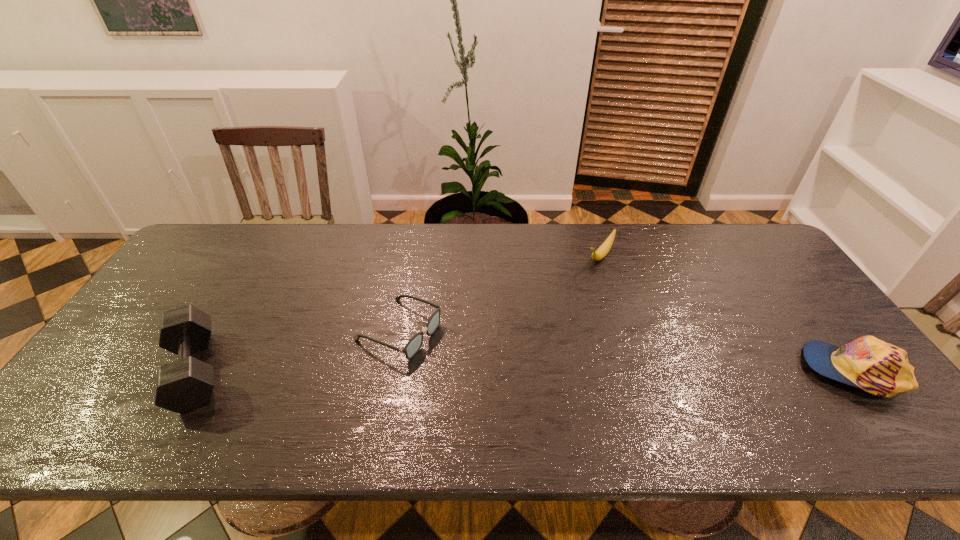
This screenshot has height=540, width=960. Find the location of `the leftmost object`. the leftmost object is located at coordinates (185, 384).

Find the location of a particular element. cap is located at coordinates (880, 368).

This screenshot has height=540, width=960. I want to click on the third object from right to left, so click(414, 344).

You are a GUI agent. You are given a task and a screenshot of the screen. Output one action in this format:
    pyautogui.click(x=<x>, y=<y>)
    Task: Click on the spectacles
    Image resolution: width=960 pixels, height=540 pixels.
    Given the screenshot: What is the action you would take?
    pyautogui.click(x=414, y=344)

Identify the location of the farthest object. The image size is (960, 540). (602, 251).

Where is `the second shortest object`? This screenshot has height=540, width=960. the second shortest object is located at coordinates (602, 251).

This screenshot has height=540, width=960. In order to click on free space located 0.280m on the back of the leftmost object in this screenshot , I will do `click(257, 263)`.

Image resolution: width=960 pixels, height=540 pixels. Identify the location of free location located on the bill of the rightmost object. (708, 370).

At what (x,y) coordinates should I click in order to perform the action: click on free space located on the bill of the rightmost object. Please return your answer as a coordinate pair (x, y). The width and height of the screenshot is (960, 540). Looking at the image, I should click on (769, 370).

Locate an element on the screen. The width and height of the screenshot is (960, 540). vacant space located 0.320m on the bill of the rightmost object is located at coordinates (676, 370).